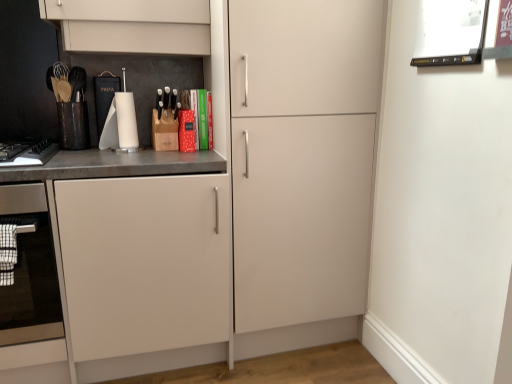
Question: From a real-world perspective, does black matte keyboard at left stand above white glossy paper towel holder at center, the second appliance in the right-to-left sequence?

Choices:
 (A) no
 (B) yes

Answer: (A)

Question: Could you tell me if black matte keyboard at left is facing white glossy paper towel holder at center, which appears as the second appliance when viewed from the front?

Choices:
 (A) yes
 (B) no

Answer: (B)

Question: Considering the relative sizes of black matte keyboard at left and white glossy paper towel holder at center, which appears as the second appliance when viewed from the front, in the image provided, is black matte keyboard at left shorter than white glossy paper towel holder at center, which appears as the second appliance when viewed from the front,?

Choices:
 (A) no
 (B) yes

Answer: (B)

Question: Considering the relative positions of black matte keyboard at left and white glossy paper towel holder at center, the second appliance in the right-to-left sequence, in the image provided, is black matte keyboard at left behind white glossy paper towel holder at center, the second appliance in the right-to-left sequence,?

Choices:
 (A) no
 (B) yes

Answer: (A)

Question: Is black matte keyboard at left not within white glossy paper towel holder at center, the second appliance in the right-to-left sequence?

Choices:
 (A) no
 (B) yes

Answer: (B)

Question: Is black matte keyboard at left in front of or behind white glossy paper towel holder at center, which appears as the second appliance when viewed from the front, in the image?

Choices:
 (A) front
 (B) behind

Answer: (A)

Question: Would you say black matte keyboard at left is to the left or to the right of white glossy paper towel holder at center, which appears as the second appliance when viewed from the front, in the picture?

Choices:
 (A) right
 (B) left

Answer: (B)

Question: Is black matte keyboard at left inside or outside of white glossy paper towel holder at center, which ranks as the first appliance in left-to-right order?

Choices:
 (A) outside
 (B) inside

Answer: (A)

Question: In terms of width, does black matte keyboard at left look wider or thinner when compared to white glossy paper towel holder at center, which appears as the second appliance when viewed from the front?

Choices:
 (A) thin
 (B) wide

Answer: (B)

Question: From the image's perspective, is black matte keyboard at left positioned above or below stainless steel oven at left?

Choices:
 (A) below
 (B) above

Answer: (B)

Question: Visually, is black matte keyboard at left positioned to the left or to the right of stainless steel oven at left?

Choices:
 (A) left
 (B) right

Answer: (B)

Question: From their relative heights in the image, would you say black matte keyboard at left is taller or shorter than stainless steel oven at left?

Choices:
 (A) short
 (B) tall

Answer: (A)

Question: From a real-world perspective, is black matte keyboard at left above or below stainless steel oven at left?

Choices:
 (A) below
 (B) above

Answer: (B)

Question: Based on their positions, is white glossy picture frame at upper right, the 2th appliance when ordered from left to right, located to the left or right of black matte keyboard at left?

Choices:
 (A) left
 (B) right

Answer: (B)

Question: Would you say white glossy picture frame at upper right, positioned as the 2th appliance in back-to-front order, is inside or outside black matte keyboard at left?

Choices:
 (A) inside
 (B) outside

Answer: (B)